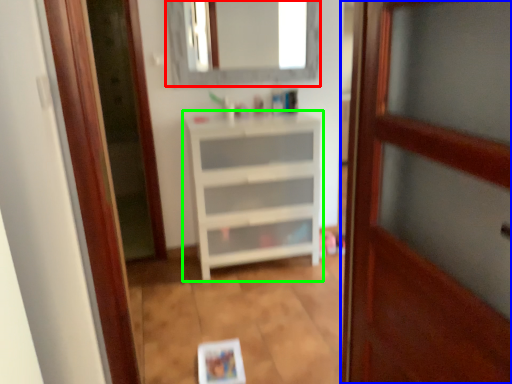
Question: Based on their relative distances, which object is nearer to mirror (highlighted by a red box)? Choose from door (highlighted by a blue box) and chest of drawers (highlighted by a green box).

Choices:
 (A) door
 (B) chest of drawers

Answer: (B)